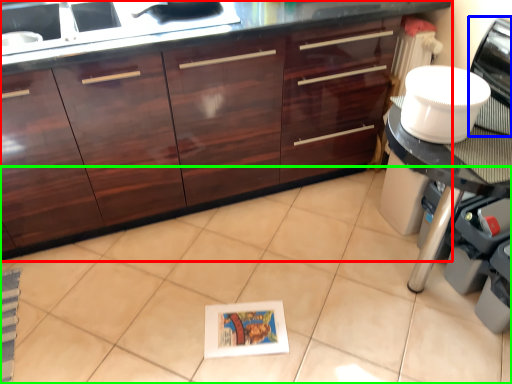
Question: Based on their relative distances, which object is farther from cabinetry (highlighted by a red box)? Choose from home appliance (highlighted by a blue box) and ceramic tile (highlighted by a green box).

Choices:
 (A) home appliance
 (B) ceramic tile

Answer: (A)